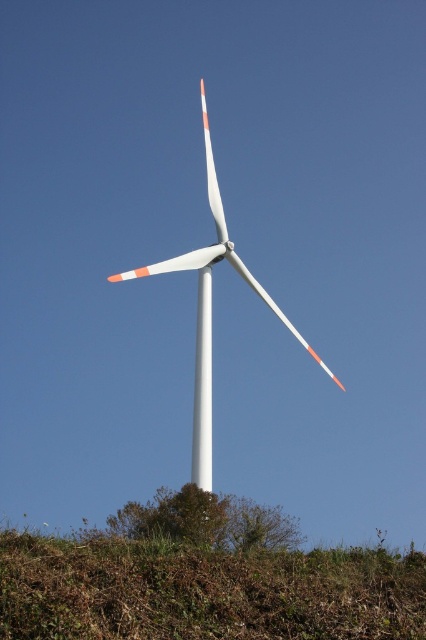
You are standing at the base of the wind turbine and want to take a photo of the green grassy area at lower center. If your camera can focus on objects up to 25 feet away, will you be able to capture the green grassy at lower center clearly?

The green grassy at lower center and camera are 23.85 feet apart from each other. Since the camera can focus up to 25 feet away, you can capture the green grassy at lower center clearly as the distance is within the camera range.